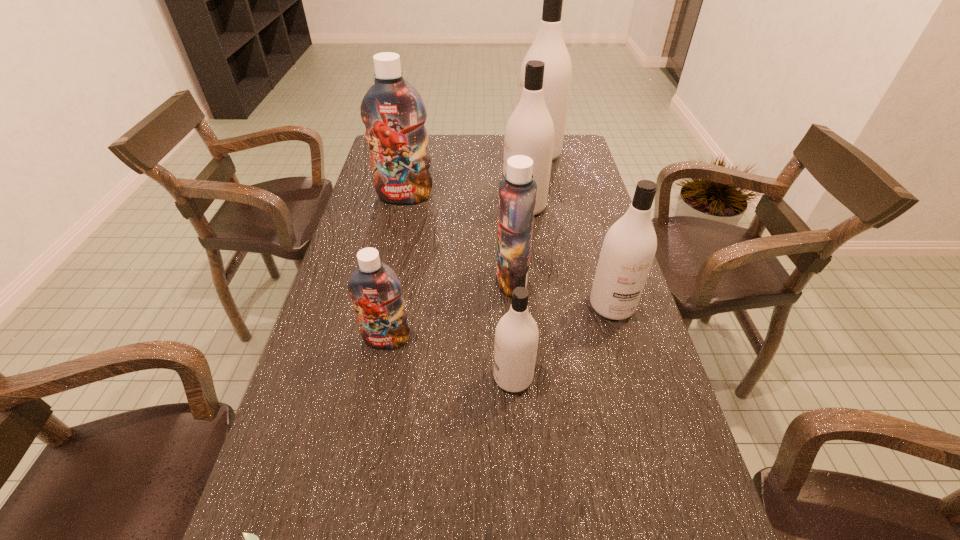
In the image, there is a desktop. Identify the location of free space at the far right corner. (567, 148).

The height and width of the screenshot is (540, 960). Identify the location of vacant space that's between the third smallest white shampoo and the nearest blue shampoo. (455, 273).

What are the coordinates of `blank region between the biggest white shampoo and the second nearest white shampoo` in the screenshot? It's located at (575, 230).

Image resolution: width=960 pixels, height=540 pixels. What are the coordinates of `free space between the third biggest white shampoo and the biggest white shampoo` in the screenshot? It's located at (575, 230).

Select which object is the fourth closest to the second smallest white shampoo. Please provide its 2D coordinates. Your answer should be formatted as a tuple, i.e. [(x, y)], where the tuple contains the x and y coordinates of a point satisfying the conditions above.

[(374, 287)]

Where is `object that stands as the third closest to the second farthest blue shampoo`? The height and width of the screenshot is (540, 960). object that stands as the third closest to the second farthest blue shampoo is located at coordinates (529, 131).

Locate which shampoo is the second closest to the third smallest white shampoo. Please provide its 2D coordinates. Your answer should be formatted as a tuple, i.e. [(x, y)], where the tuple contains the x and y coordinates of a point satisfying the conditions above.

[(517, 192)]

The height and width of the screenshot is (540, 960). Identify the location of the fifth closest shampoo to the second smallest blue shampoo. (392, 110).

This screenshot has height=540, width=960. What are the coordinates of `white shampoo that is the closest to the farthest blue shampoo` in the screenshot? It's located at (529, 131).

Locate which white shampoo ranks third in proximity to the third smallest white shampoo. Please provide its 2D coordinates. Your answer should be formatted as a tuple, i.e. [(x, y)], where the tuple contains the x and y coordinates of a point satisfying the conditions above.

[(516, 335)]